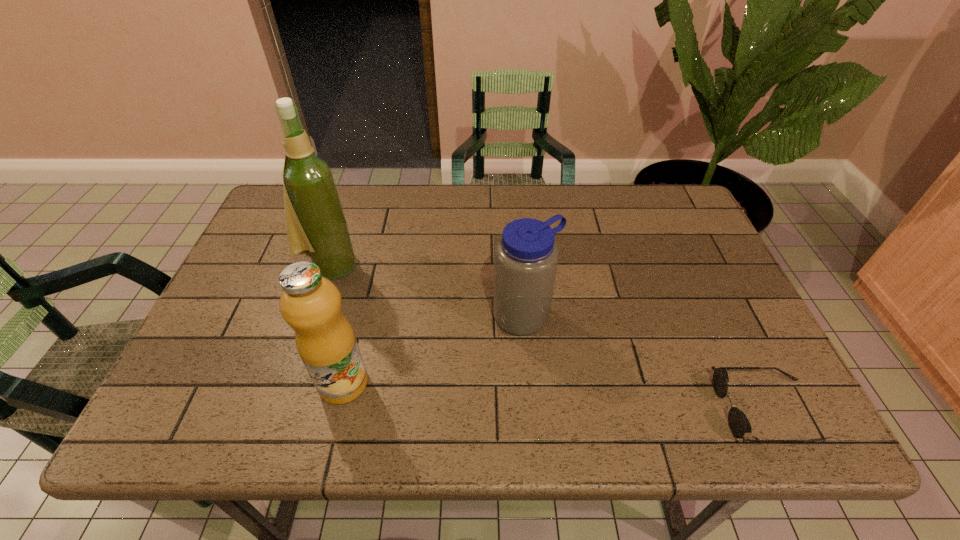
This screenshot has width=960, height=540. I want to click on vacant space at the right edge of the desktop, so click(x=763, y=355).

The width and height of the screenshot is (960, 540). What are the coordinates of `free space at the near left corner of the desktop` in the screenshot? It's located at (200, 359).

Find the location of a particular element. The image size is (960, 540). vacant space at the far right corner of the desktop is located at coordinates (640, 194).

The image size is (960, 540). Find the location of `free point between the water bottle and the farthest object`. free point between the water bottle and the farthest object is located at coordinates pyautogui.click(x=427, y=291).

Image resolution: width=960 pixels, height=540 pixels. Identify the location of unoccupied area between the water bottle and the third shortest object. (434, 349).

Identify the location of empty space that is in between the tallest object and the rightmost object. The image size is (960, 540). (548, 337).

In order to click on free space between the water bottle and the tallest object in this screenshot , I will do `click(427, 291)`.

Choose which object is the second nearest neighbor to the second farthest object. Please provide its 2D coordinates. Your answer should be formatted as a tuple, i.e. [(x, y)], where the tuple contains the x and y coordinates of a point satisfying the conditions above.

[(739, 424)]

I want to click on object that is the second closest to the farthest object, so click(x=526, y=257).

Identify the location of free point that satisfies the following two spatial constraints: 1. on the front side of the third object from left to right; 2. on the right side of the wine bottle. Image resolution: width=960 pixels, height=540 pixels. (314, 316).